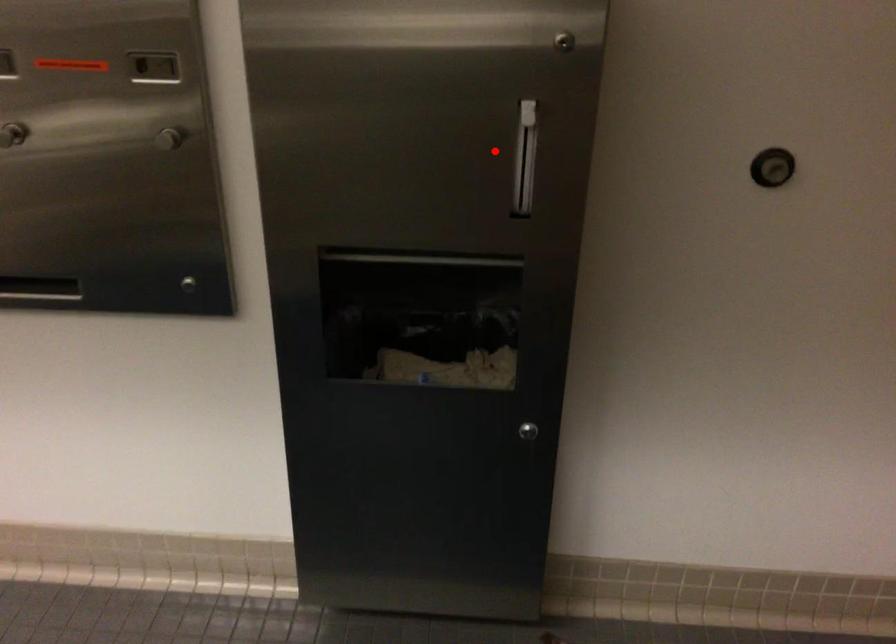
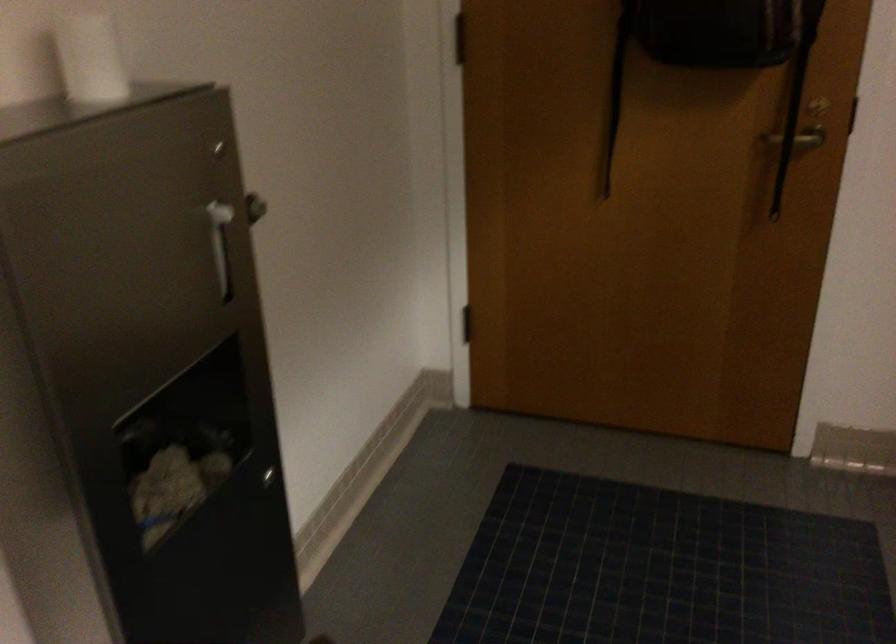
Where in the second image is the point corresponding to the highlighted location from the first image?

(220, 243)